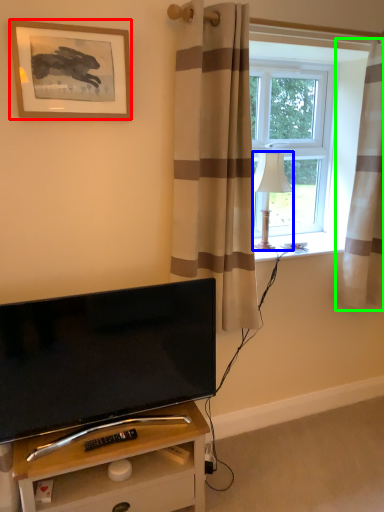
Question: Considering the real-world distances, which object is farthest from picture frame (highlighted by a red box)? lamp (highlighted by a blue box) or curtain (highlighted by a green box)?

Choices:
 (A) lamp
 (B) curtain

Answer: (B)